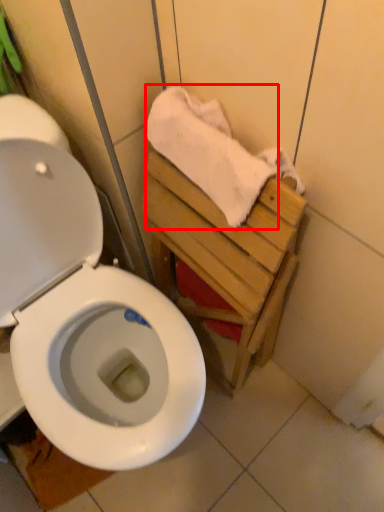
Question: Considering the relative positions of bath towel (annotated by the red box) and tile in the image provided, where is bath towel (annotated by the red box) located with respect to the staircase?

Choices:
 (A) right
 (B) left

Answer: (A)